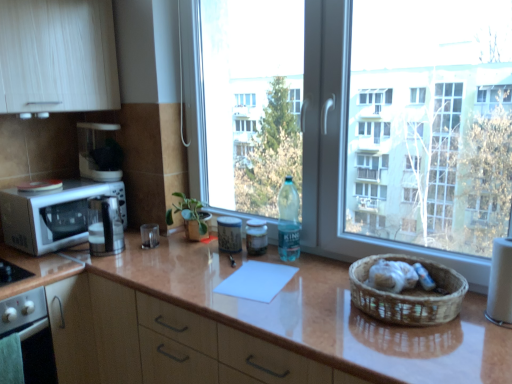
This screenshot has width=512, height=384. What are the coordinates of `free area in between brown woven basket at right and matte glass jar at center, the second appliance when ordered from top to bottom` in the screenshot? It's located at (295, 276).